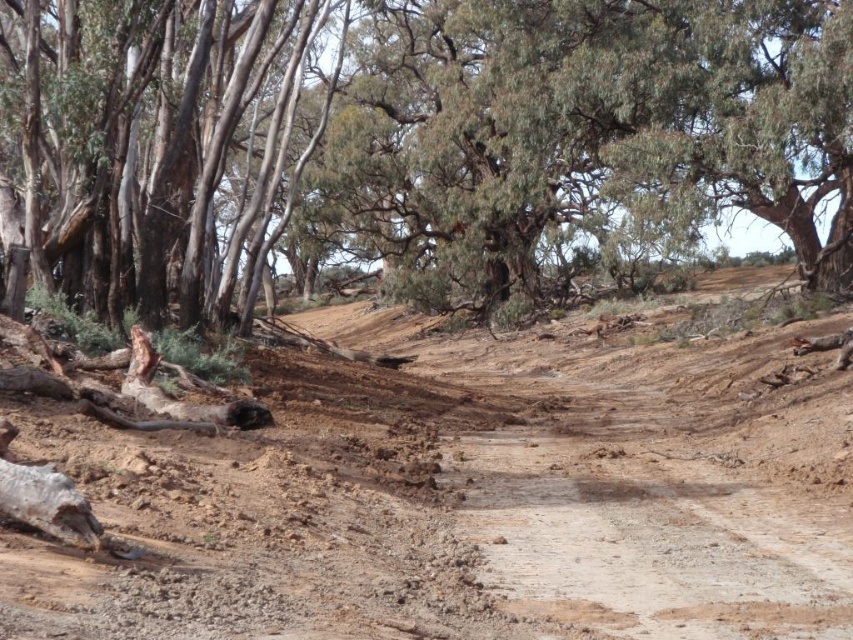
You are a hiker who wants to take a photo of the dull brown dirt at center without the brown rough tree at upper left blocking the view. How should you position yourself relative to the objects?

Move to a position in front of the brown rough tree at upper left so that the dull brown dirt at center is visible behind it. Since the dull brown dirt at center is behind the brown rough tree at upper left, moving in front of the tree will allow you to see the dirt without obstruction.

You are a hiker standing at the center of the dirt path in the forest. You want to locate the brown rough tree at upper left. Which direction should you look to find it?

The brown rough tree at upper left is located at point (x=413, y=141), so you should look towards the upper left direction to find it.

Based on the photo, you are a hiker who wants to take a photo of the smooth bark tree at upper left and the dull brown dirt at center. Since you can only focus on one object at a time, which object should you focus on to ensure the other is in the background?

You should focus on the smooth bark tree at upper left because the dull brown dirt at center is to the right of it, meaning the dull brown dirt at center will be in the background.